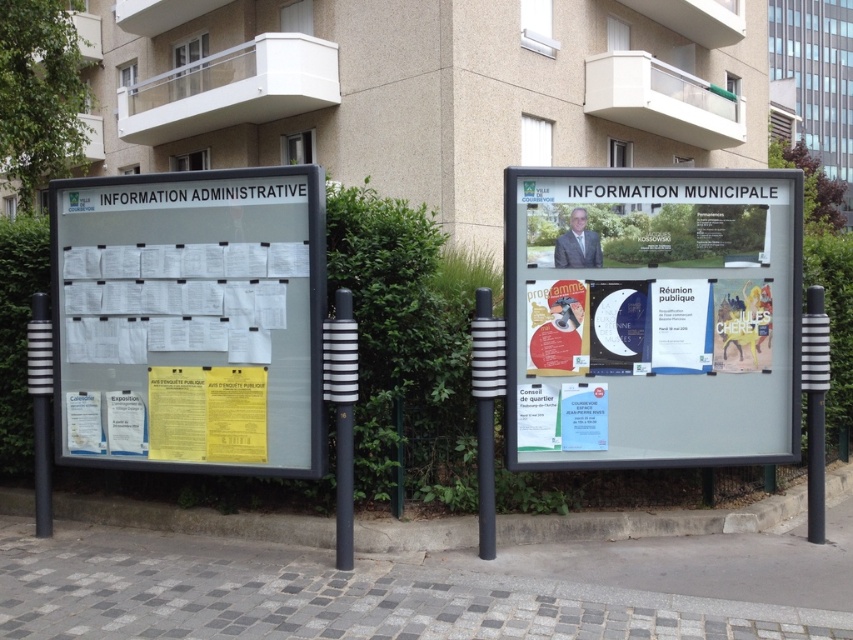
Can you confirm if white plastic board at center is smaller than white paper at left?

Yes.

Based on the photo, is white plastic board at center wider than white paper at left?

Yes, white plastic board at center is wider than white paper at left.

At what (x,y) coordinates should I click in order to perform the action: click on white plastic board at center. Please return your answer as a coordinate pair (x, y). This screenshot has height=640, width=853. Looking at the image, I should click on (651, 316).

Is point (209, 374) closer to camera compared to point (7, 384)?

Yes, it is in front of point (7, 384).

Is point (96, 243) positioned before point (22, 369)?

Yes, it is.

Identify the location of white paper at left. (190, 320).

Can you confirm if white plastic board at center is wider than green leafy hedge at left?

Yes.

Can you confirm if white plastic board at center is thinner than green leafy hedge at left?

Incorrect, white plastic board at center's width is not less than green leafy hedge at left's.

Describe the element at coordinates (651, 316) in the screenshot. The image size is (853, 640). I see `white plastic board at center` at that location.

Locate an element on the screen. This screenshot has width=853, height=640. white plastic board at center is located at coordinates (651, 316).